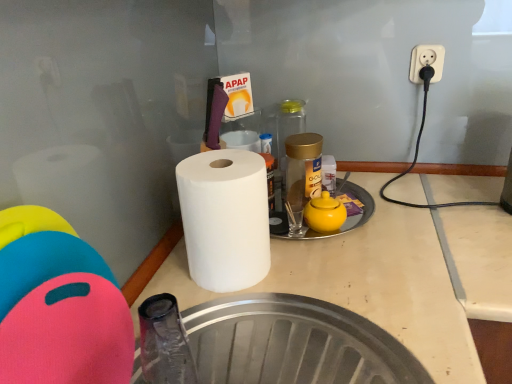
What is the approximate width of gold metallic jar at center, which appears as the second bottle when viewed from the back?

It is 3.98 inches.

You are a GUI agent. You are given a task and a screenshot of the screen. Output one action in this format:
    pyautogui.click(x=<x>, y=<y>)
    Task: Click on the rubberized plastic cutting board at left
    The width and height of the screenshot is (512, 384).
    Given the screenshot: What is the action you would take?
    pyautogui.click(x=58, y=305)

Locate an element on the screen. The width and height of the screenshot is (512, 384). white matte paper towel at center is located at coordinates pyautogui.click(x=225, y=218).

The height and width of the screenshot is (384, 512). Find the location of `white plastic outlet at upper right`. white plastic outlet at upper right is located at coordinates (426, 62).

The height and width of the screenshot is (384, 512). What do you see at coordinates (426, 62) in the screenshot?
I see `white plastic outlet at upper right` at bounding box center [426, 62].

At what (x,y) coordinates should I click in order to perform the action: click on transparent glass bottle at center, the 1th bottle from the back. Please return your answer as a coordinate pair (x, y). Image resolution: width=512 pixels, height=384 pixels. Looking at the image, I should click on (289, 124).

The width and height of the screenshot is (512, 384). What do you see at coordinates (289, 124) in the screenshot?
I see `transparent glass bottle at center, the 1th bottle from the back` at bounding box center [289, 124].

Identify the location of gold metallic jar at center, which appears as the second bottle when viewed from the back. The height and width of the screenshot is (384, 512). (303, 168).

Which is more to the left, yellow matte teapot at center or rubberized plastic cutting board at left?

rubberized plastic cutting board at left.

Is point (355, 198) positioned after point (100, 313)?

Yes, point (355, 198) is behind point (100, 313).

Where is `toy above the yellow matte teapot at center (from a real-world perspective)`? toy above the yellow matte teapot at center (from a real-world perspective) is located at coordinates (58, 305).

From a real-world perspective, which is physically below, yellow matte teapot at center or rubberized plastic cutting board at left?

yellow matte teapot at center, from a real-world perspective.

Can you confirm if yellow matte teapot at center is wider than white matte paper towel at center?

No.

Does point (332, 234) lie in front of point (252, 226)?

No, (332, 234) is further to viewer.

Between yellow matte teapot at center and white matte paper towel at center, which one has less height?

Standing shorter between the two is yellow matte teapot at center.

From a real-world perspective, relative to white matte paper towel at center, is yellow matte teapot at center vertically above or below?

From a real-world perspective, yellow matte teapot at center is physically below white matte paper towel at center.

Would you say rubberized plastic cutting board at left is inside or outside gold metallic jar at center, which appears as the second bottle when viewed from the back?

rubberized plastic cutting board at left is not enclosed by gold metallic jar at center, which appears as the second bottle when viewed from the back.

In the image, there is a gold metallic jar at center, the 1th bottle positioned from the front. In order to click on toy below it (from the image's perspective) in this screenshot , I will do `click(58, 305)`.

Is the depth of rubberized plastic cutting board at left greater than that of gold metallic jar at center, the 1th bottle positioned from the front?

No, it is not.

Can you tell me how much rubberized plastic cutting board at left and yellow matte teapot at center differ in facing direction?

rubberized plastic cutting board at left and yellow matte teapot at center are facing 27.9 degrees away from each other.

In terms of width, does rubberized plastic cutting board at left look wider or thinner when compared to yellow matte teapot at center?

rubberized plastic cutting board at left is thinner than yellow matte teapot at center.

Based on the photo, between rubberized plastic cutting board at left and yellow matte teapot at center, which one appears on the left side from the viewer's perspective?

Positioned to the left is rubberized plastic cutting board at left.

From a real-world perspective, does rubberized plastic cutting board at left sit lower than yellow matte teapot at center?

Actually, rubberized plastic cutting board at left is physically above yellow matte teapot at center in the real world.

From the image's perspective, between transparent glass bottle at center, the 1th bottle from the back, and white matte paper towel at center, who is located below?

From the image's view, white matte paper towel at center is below.

This screenshot has height=384, width=512. I want to click on paper towel that appears below the transparent glass bottle at center, marked as the 2th bottle in a front-to-back arrangement (from a real-world perspective), so point(225,218).

Can you confirm if transparent glass bottle at center, marked as the 2th bottle in a front-to-back arrangement, is positioned to the left of white matte paper towel at center?

No.

Is transparent glass bottle at center, the 1th bottle from the back, shorter than white matte paper towel at center?

Indeed, transparent glass bottle at center, the 1th bottle from the back, has a lesser height compared to white matte paper towel at center.

How far apart are white matte paper towel at center and rubberized plastic cutting board at left?

white matte paper towel at center and rubberized plastic cutting board at left are 9.74 inches apart.

Does point (191, 198) appear closer or farther from the camera than point (82, 288)?

Point (191, 198) appears to be farther away from the viewer than point (82, 288).

Based on their sizes in the image, would you say white matte paper towel at center is bigger or smaller than rubberized plastic cutting board at left?

white matte paper towel at center is smaller than rubberized plastic cutting board at left.

Is point (296, 235) less distant than point (313, 165)?

Yes, point (296, 235) is in front of point (313, 165).

From the image's perspective, which object appears higher, yellow matte teapot at center or gold metallic jar at center, which appears as the second bottle when viewed from the back?

gold metallic jar at center, which appears as the second bottle when viewed from the back, from the image's perspective.

Which of these two, yellow matte teapot at center or gold metallic jar at center, the 1th bottle positioned from the front, is thinner?

Thinner between the two is yellow matte teapot at center.

The image size is (512, 384). Identify the location of manhole lying above the rubberized plastic cutting board at left (from the image's perspective). (336, 230).

You are a GUI agent. You are given a task and a screenshot of the screen. Output one action in this format:
    pyautogui.click(x=<x>, y=<y>)
    Task: Click on the paper towel that appears below the yellow matte teapot at center (from the image's perspective)
    The width and height of the screenshot is (512, 384).
    Given the screenshot: What is the action you would take?
    pyautogui.click(x=225, y=218)

Based on their spatial positions, is white plastic outlet at upper right or yellow matte teapot at center further from rubberized plastic cutting board at left?

white plastic outlet at upper right.

Estimate the real-world distances between objects in this image. Which object is further from gold metallic jar at center, which appears as the second bottle when viewed from the back, rubberized plastic cutting board at left or yellow matte teapot at center?

rubberized plastic cutting board at left is further to gold metallic jar at center, which appears as the second bottle when viewed from the back.

When comparing their distances from yellow matte teapot at center, does transparent glass bottle at center, marked as the 2th bottle in a front-to-back arrangement, or white matte paper towel at center seem closer?

The object closer to yellow matte teapot at center is white matte paper towel at center.

Which object lies further to the anchor point rubberized plastic cutting board at left, white matte paper towel at center or yellow matte teapot at center?

yellow matte teapot at center is further to rubberized plastic cutting board at left.

Which object lies further to the anchor point transparent glass bottle at center, the 1th bottle from the back, yellow matte teapot at center or white plastic outlet at upper right?

white plastic outlet at upper right.

Based on their spatial positions, is yellow matte teapot at center or transparent glass bottle at center, marked as the 2th bottle in a front-to-back arrangement, further from gold metallic jar at center, the 1th bottle positioned from the front?

transparent glass bottle at center, marked as the 2th bottle in a front-to-back arrangement, is positioned further to the anchor gold metallic jar at center, the 1th bottle positioned from the front.

Considering their positions, is gold metallic jar at center, which appears as the second bottle when viewed from the back, positioned further to white plastic outlet at upper right than transparent glass bottle at center, marked as the 2th bottle in a front-to-back arrangement?

gold metallic jar at center, which appears as the second bottle when viewed from the back, is positioned further to the anchor white plastic outlet at upper right.

Based on their spatial positions, is white plastic outlet at upper right or rubberized plastic cutting board at left closer to yellow matte teapot at center?

white plastic outlet at upper right is closer to yellow matte teapot at center.

Where is `manhole located between rubberized plastic cutting board at left and gold metallic jar at center, which appears as the second bottle when viewed from the back, in the depth direction`? manhole located between rubberized plastic cutting board at left and gold metallic jar at center, which appears as the second bottle when viewed from the back, in the depth direction is located at coordinates (336, 230).

This screenshot has width=512, height=384. In order to click on manhole between rubberized plastic cutting board at left and transparent glass bottle at center, marked as the 2th bottle in a front-to-back arrangement, along the z-axis in this screenshot , I will do `click(336, 230)`.

Where is `manhole between white matte paper towel at center and gold metallic jar at center, the 1th bottle positioned from the front, along the z-axis`? The width and height of the screenshot is (512, 384). manhole between white matte paper towel at center and gold metallic jar at center, the 1th bottle positioned from the front, along the z-axis is located at coordinates (336, 230).

This screenshot has height=384, width=512. I want to click on electric outlet between white matte paper towel at center and transparent glass bottle at center, marked as the 2th bottle in a front-to-back arrangement, in the front-back direction, so click(x=426, y=62).